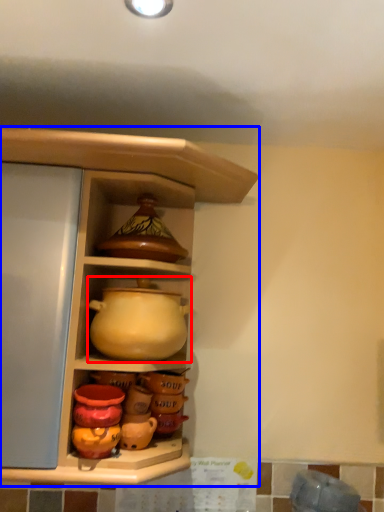
Question: Among these objects, which one is nearest to the camera, jug (highlighted by a red box) or shelf (highlighted by a blue box)?

Choices:
 (A) jug
 (B) shelf

Answer: (B)